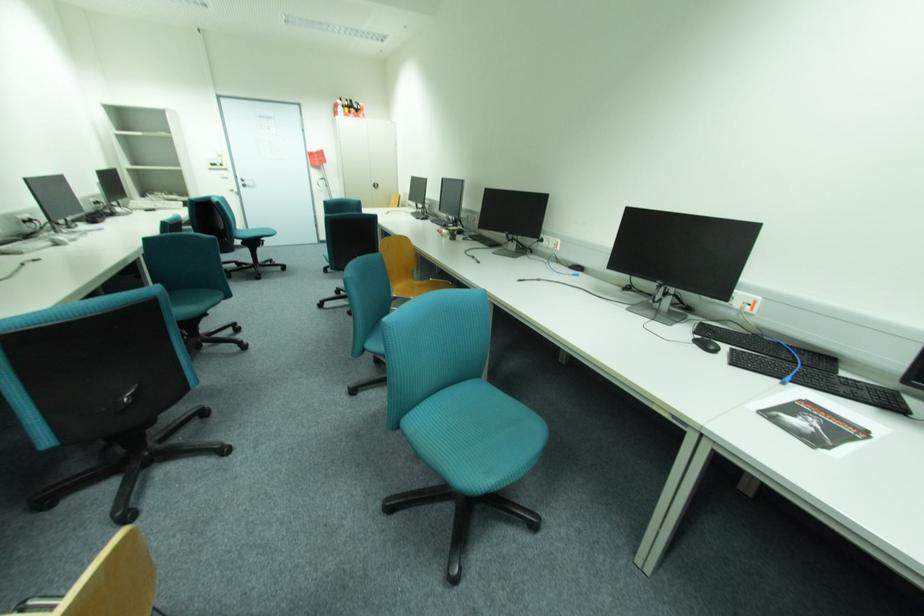
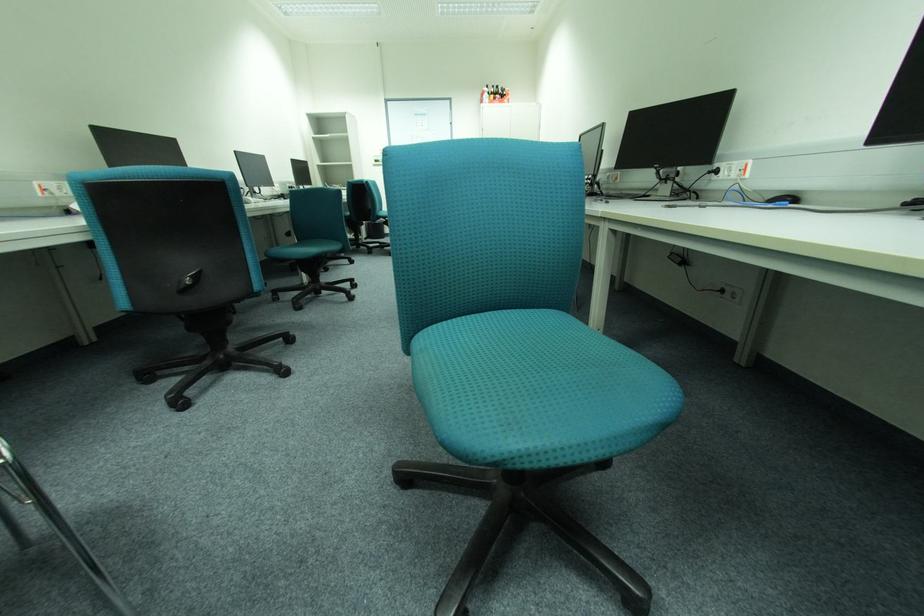
Question: The camera is either moving clockwise (left) or counter-clockwise (right) around the object. The first image is from the beginning of the video and the second image is from the end. Is the camera moving left or right when shooting the video?

Choices:
 (A) Left
 (B) Right

Answer: (B)